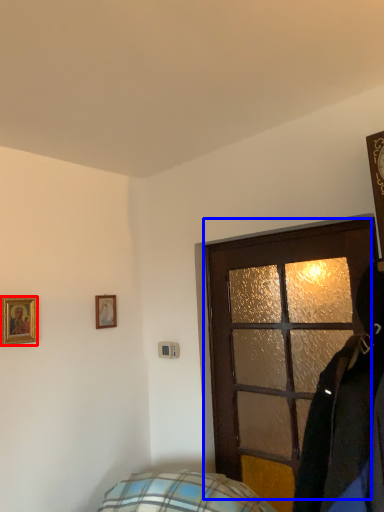
Question: Among these objects, which one is farthest to the camera, picture frame (highlighted by a red box) or door (highlighted by a blue box)?

Choices:
 (A) picture frame
 (B) door

Answer: (A)